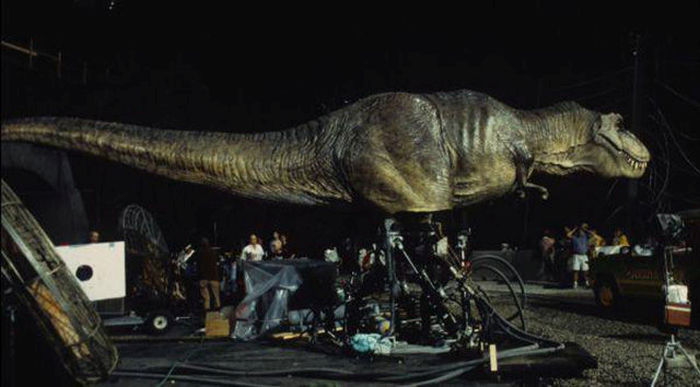
Find the location of a particular element. The width and height of the screenshot is (700, 387). wires is located at coordinates (496, 256).